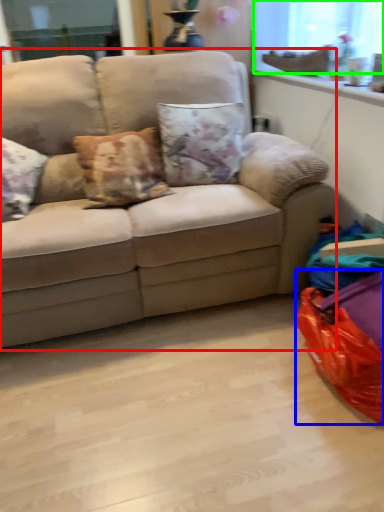
Question: Considering the real-world distances, which object is farthest from studio couch (highlighted by a red box)? bean bag chair (highlighted by a blue box) or window screen (highlighted by a green box)?

Choices:
 (A) bean bag chair
 (B) window screen

Answer: (B)